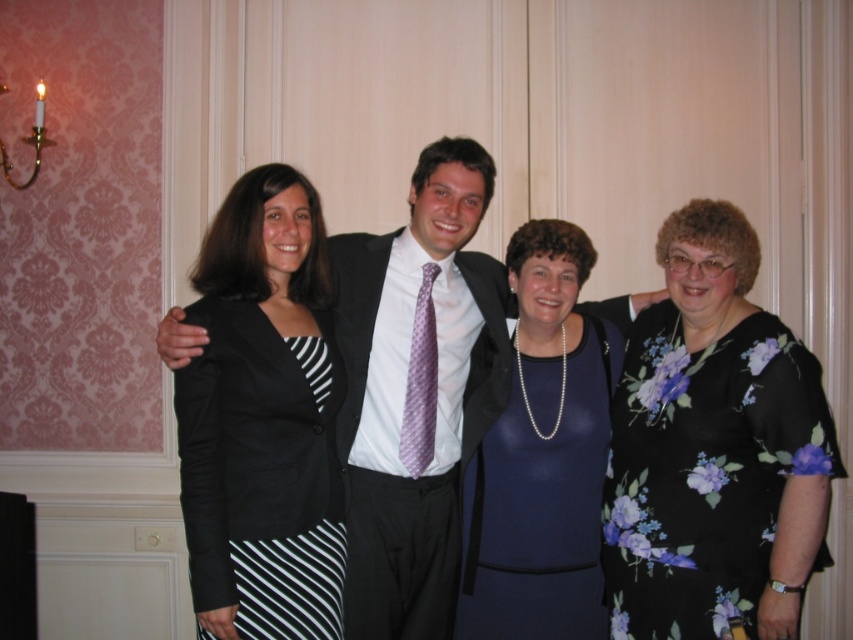
You are a photographer at the event and need to adjust the lighting so that both the floral print dress at right and the black striped skirt at left are equally illuminated. Given their heights, which one might require a higher light stand to ensure proper coverage?

The floral print dress at right is taller than the black striped skirt at left, so the higher light stand should be positioned for the floral print dress at right to ensure it is adequately lit.

You are a photographer adjusting your camera settings to capture the group photo. You notice the floral print dress at right and the black striped skirt at left. Which of these two items requires a wider aperture setting to ensure the subject wearing it is in focus?

The floral print dress at right requires a wider aperture setting because it is larger in size than the black striped skirt at left, necessitating a greater depth of field to capture its details clearly.